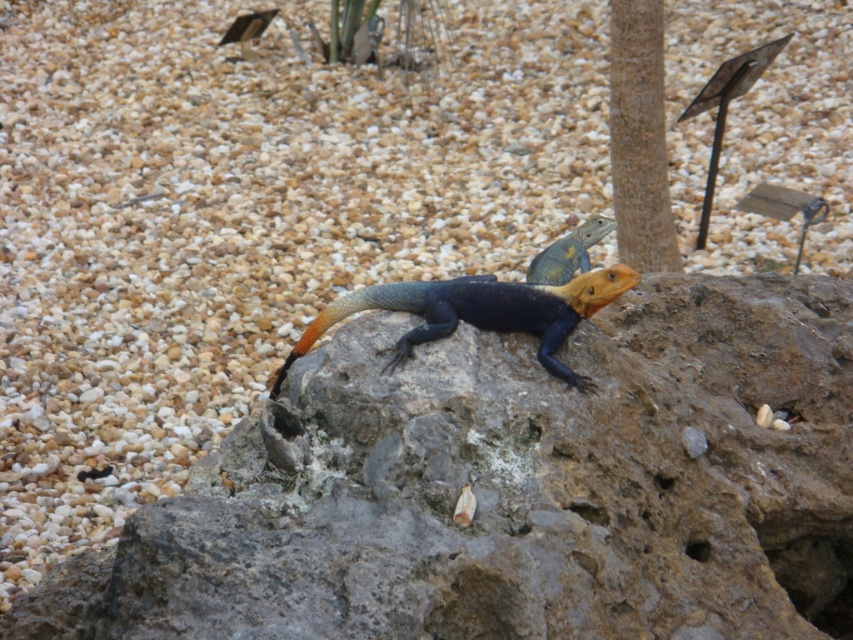
Question: Which of the following is the farthest from the observer?

Choices:
 (A) (668, 195)
 (B) (453, 296)
 (C) (781, 442)

Answer: (A)

Question: Does shiny blue lizard at center appear on the right side of smooth brown pole at upper center?

Choices:
 (A) yes
 (B) no

Answer: (B)

Question: Can you confirm if rough stone boulder at center is thinner than shiny blue lizard at center?

Choices:
 (A) yes
 (B) no

Answer: (B)

Question: Estimate the real-world distances between objects in this image. Which object is closer to the shiny blue lizard at center?

Choices:
 (A) rough stone boulder at center
 (B) smooth brown pole at upper center

Answer: (A)

Question: Which point is farther to the camera?

Choices:
 (A) shiny blue lizard at center
 (B) rough stone boulder at center
 (C) smooth brown pole at upper center

Answer: (C)

Question: Is shiny blue lizard at center to the left of smooth brown pole at upper center from the viewer's perspective?

Choices:
 (A) yes
 (B) no

Answer: (A)